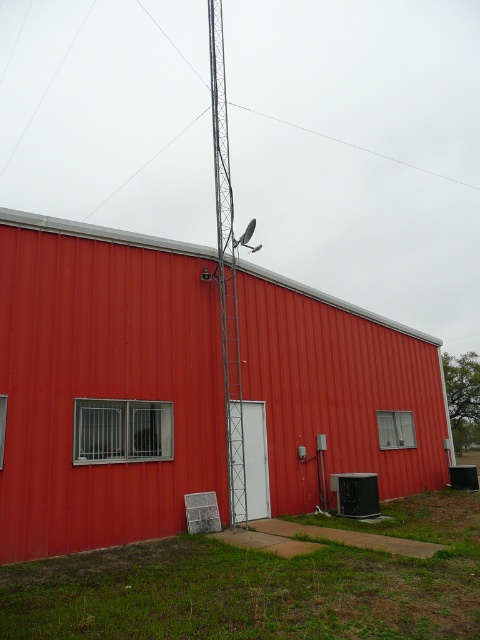
Question: Does metallic red barn at center lie behind metallic silver antenna at center?

Choices:
 (A) yes
 (B) no

Answer: (B)

Question: Which of the following is the farthest from the observer?

Choices:
 (A) (214, 275)
 (B) (218, 29)

Answer: (B)

Question: Is metallic red barn at center to the right of metallic silver antenna at center from the viewer's perspective?

Choices:
 (A) yes
 (B) no

Answer: (A)

Question: Observing the image, what is the correct spatial positioning of metallic red barn at center in reference to metallic silver antenna at center?

Choices:
 (A) left
 (B) right

Answer: (B)

Question: Among these points, which one is farthest from the camera?

Choices:
 (A) (362, 417)
 (B) (213, 17)

Answer: (B)